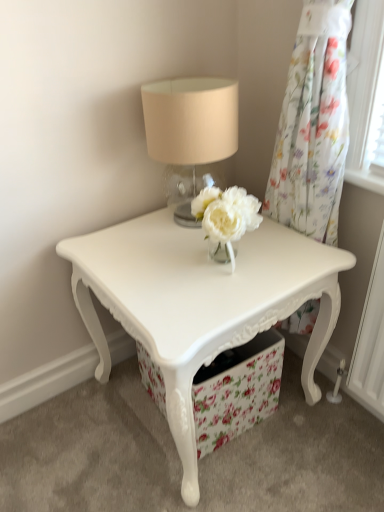
This screenshot has width=384, height=512. Describe the element at coordinates (200, 302) in the screenshot. I see `white glossy table at center` at that location.

What do you see at coordinates (237, 390) in the screenshot? I see `floral fabric drawer at center` at bounding box center [237, 390].

Where is `white glossy table at center`? Image resolution: width=384 pixels, height=512 pixels. white glossy table at center is located at coordinates (200, 302).

Is white glossy table at center aimed at matte glass table lamp at upper center?

No, white glossy table at center does not turn towards matte glass table lamp at upper center.

Does white glossy table at center have a lesser width compared to matte glass table lamp at upper center?

No, white glossy table at center is not thinner than matte glass table lamp at upper center.

The height and width of the screenshot is (512, 384). What are the coordinates of `table on the right of matte glass table lamp at upper center` in the screenshot? It's located at (200, 302).

From a real-world perspective, which is physically below, white glossy table at center or floral fabric drawer at center?

floral fabric drawer at center.

Which is closer, (153,255) or (239,352)?

Point (153,255) appears to be closer to the viewer than point (239,352).

Identify the location of drawer on the right of white glossy table at center. This screenshot has height=512, width=384. (237, 390).

Does white glossy table at center contain floral sheer curtain at upper right?

That's incorrect, floral sheer curtain at upper right is not inside white glossy table at center.

Looking at this image, is white glossy table at center in contact with floral sheer curtain at upper right?

They are not placed beside each other.

From a real-world perspective, does white glossy table at center sit lower than floral sheer curtain at upper right?

Correct, in the physical world, white glossy table at center is lower than floral sheer curtain at upper right.

From the image's perspective, which one is positioned lower, white glossy table at center or floral sheer curtain at upper right?

white glossy table at center.

Which object is thinner, floral fabric drawer at center or floral sheer curtain at upper right?

Thinner between the two is floral sheer curtain at upper right.

Is point (218, 384) less distant than point (337, 158)?

No, it is not.

Which object is positioned more to the left, floral fabric drawer at center or floral sheer curtain at upper right?

Positioned to the left is floral fabric drawer at center.

The width and height of the screenshot is (384, 512). What are the coordinates of `curtain above the floral fabric drawer at center (from a real-world perspective)` in the screenshot? It's located at (313, 125).

Is white glossy table at center inside matte glass table lamp at upper center?

No, white glossy table at center is not inside matte glass table lamp at upper center.

Find the location of `table lamp that is above the white glossy table at center (from the image's perspective)`. table lamp that is above the white glossy table at center (from the image's perspective) is located at coordinates (190, 133).

Which of these two, matte glass table lamp at upper center or white glossy table at center, is wider?

Wider between the two is white glossy table at center.

How different are the orientations of matte glass table lamp at upper center and white glossy table at center in degrees?

matte glass table lamp at upper center and white glossy table at center are facing 0.111 degrees away from each other.

From a real-world perspective, which is physically above, floral fabric drawer at center or white glossy table at center?

white glossy table at center, from a real-world perspective.

Does floral fabric drawer at center have a greater height compared to white glossy table at center?

Incorrect, the height of floral fabric drawer at center is not larger of that of white glossy table at center.

From the image's perspective, is floral fabric drawer at center under white glossy table at center?

Correct, floral fabric drawer at center appears lower than white glossy table at center in the image.

You are a GUI agent. You are given a task and a screenshot of the screen. Output one action in this format:
    pyautogui.click(x=<x>, y=<y>)
    Task: Click on the table located above the floral fabric drawer at center (from the image's perspective)
    
    Given the screenshot: What is the action you would take?
    pyautogui.click(x=200, y=302)

Is floral fabric drawer at center positioned before matte glass table lamp at upper center?

That is False.

Is floral fabric drawer at center far away from matte glass table lamp at upper center?

No, there isn't a large distance between floral fabric drawer at center and matte glass table lamp at upper center.

You are a GUI agent. You are given a task and a screenshot of the screen. Output one action in this format:
    pyautogui.click(x=<x>, y=<y>)
    Task: Click on the table lamp on the left of the floral fabric drawer at center
    Image resolution: width=384 pixels, height=512 pixels.
    Given the screenshot: What is the action you would take?
    pyautogui.click(x=190, y=133)

Find the location of a particular element. table beneath the matte glass table lamp at upper center (from a real-world perspective) is located at coordinates (200, 302).

I want to click on drawer on the right of the white glossy table at center, so click(x=237, y=390).

Which object lies further to the anchor point floral sheer curtain at upper right, matte glass table lamp at upper center or floral fabric drawer at center?

floral fabric drawer at center is positioned further to the anchor floral sheer curtain at upper right.

From the image, which object appears to be nearer to floral sheer curtain at upper right, matte glass table lamp at upper center or white glossy table at center?

Based on the image, matte glass table lamp at upper center appears to be nearer to floral sheer curtain at upper right.

Considering their positions, is floral sheer curtain at upper right positioned closer to matte glass table lamp at upper center than white glossy table at center?

The object closer to matte glass table lamp at upper center is floral sheer curtain at upper right.

Based on their spatial positions, is floral sheer curtain at upper right or matte glass table lamp at upper center closer to floral fabric drawer at center?

The object closer to floral fabric drawer at center is floral sheer curtain at upper right.

From the image, which object appears to be nearer to matte glass table lamp at upper center, floral fabric drawer at center or white glossy table at center?

white glossy table at center is positioned closer to the anchor matte glass table lamp at upper center.

From the image, which object appears to be nearer to white glossy table at center, floral fabric drawer at center or floral sheer curtain at upper right?

Based on the image, floral fabric drawer at center appears to be nearer to white glossy table at center.

Considering their positions, is white glossy table at center positioned further to matte glass table lamp at upper center than floral fabric drawer at center?

Among the two, floral fabric drawer at center is located further to matte glass table lamp at upper center.

Based on their spatial positions, is matte glass table lamp at upper center or floral sheer curtain at upper right closer to white glossy table at center?

matte glass table lamp at upper center lies closer to white glossy table at center than the other object.

Identify the location of table between floral sheer curtain at upper right and floral fabric drawer at center vertically. The width and height of the screenshot is (384, 512). (200, 302).

You are a GUI agent. You are given a task and a screenshot of the screen. Output one action in this format:
    pyautogui.click(x=<x>, y=<y>)
    Task: Click on the curtain between matte glass table lamp at upper center and white glossy table at center in the vertical direction
    This screenshot has height=512, width=384.
    Given the screenshot: What is the action you would take?
    pyautogui.click(x=313, y=125)

Identify the location of table between matte glass table lamp at upper center and floral fabric drawer at center vertically. This screenshot has width=384, height=512. (200, 302).

The width and height of the screenshot is (384, 512). What are the coordinates of `curtain between matte glass table lamp at upper center and floral fabric drawer at center vertically` in the screenshot? It's located at (313, 125).